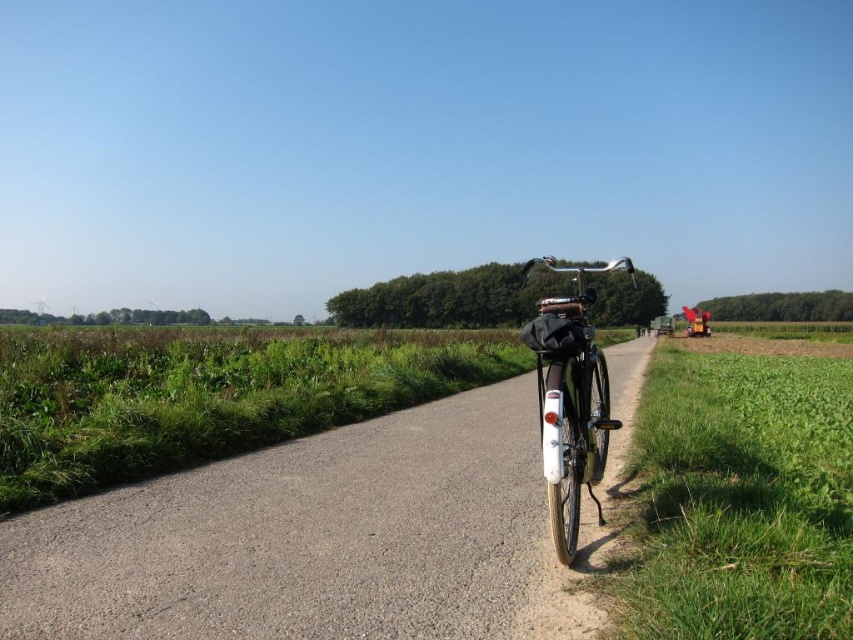
Who is shorter, asphalt road at center or shiny metallic bicycle at center?

asphalt road at center

Does asphalt road at center come behind shiny metallic bicycle at center?

That is False.

Image resolution: width=853 pixels, height=640 pixels. I want to click on asphalt road at center, so click(x=310, y=540).